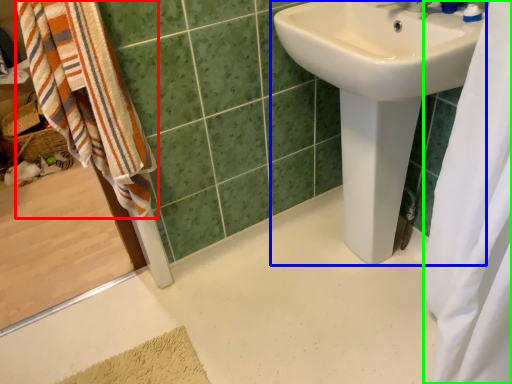
Question: Considering the real-world distances, which object is closest to beach towel (highlighted by a red box)? sink (highlighted by a blue box) or shower curtain (highlighted by a green box).

Choices:
 (A) sink
 (B) shower curtain

Answer: (A)